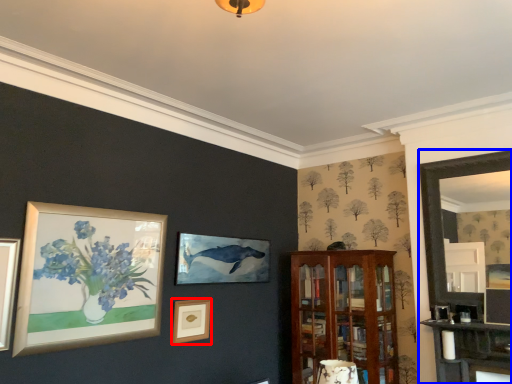
Question: Which point is further to the camera, picture frame (highlighted by a red box) or fireplace (highlighted by a blue box)?

Choices:
 (A) picture frame
 (B) fireplace

Answer: (A)